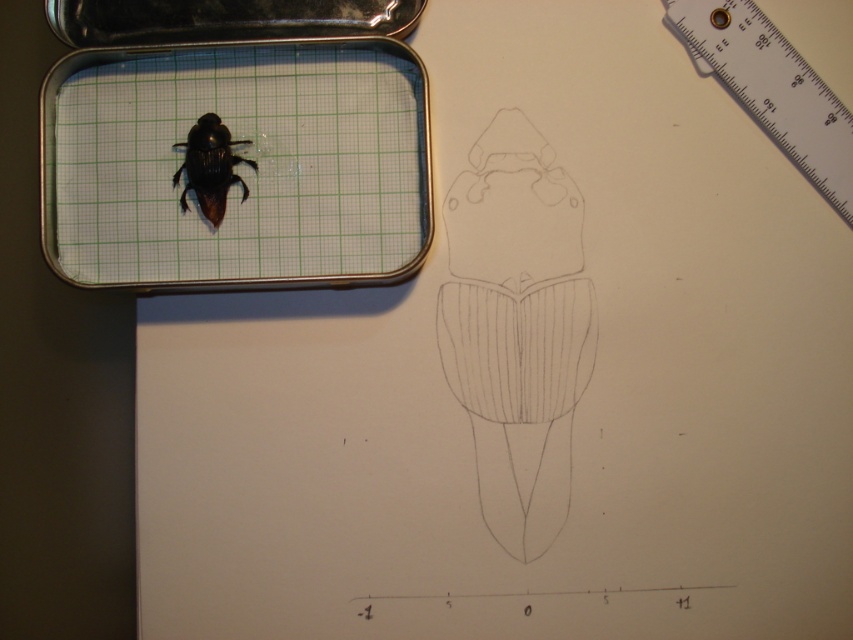
What is the 2D coordinate of the white plastic ruler at upper right?

The white plastic ruler at upper right is located at the coordinate point of (773, 88).